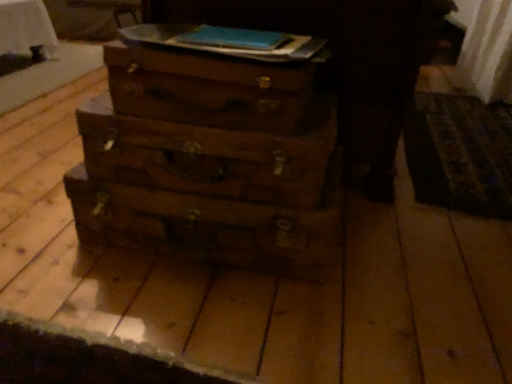
The image size is (512, 384). Find the location of `free space in front of wooden drawer at center, which is the third drawer in top-to-bottom order`. free space in front of wooden drawer at center, which is the third drawer in top-to-bottom order is located at coordinates (202, 323).